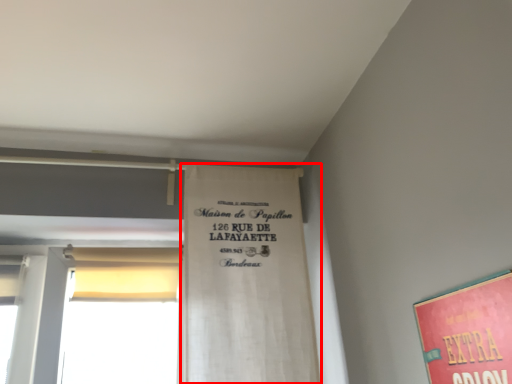
Question: Considering the relative positions of bulletin board (annotated by the red box) and poster in the image provided, where is bulletin board (annotated by the red box) located with respect to the staircase?

Choices:
 (A) left
 (B) right

Answer: (A)